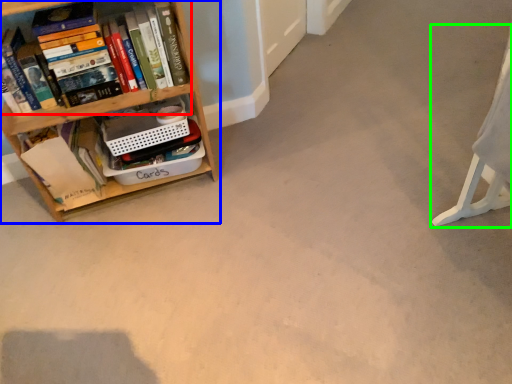
Question: Estimate the real-world distances between objects in this image. Which object is closer to book (highlighted by a red box), shelf (highlighted by a blue box) or swivel chair (highlighted by a green box)?

Choices:
 (A) shelf
 (B) swivel chair

Answer: (A)